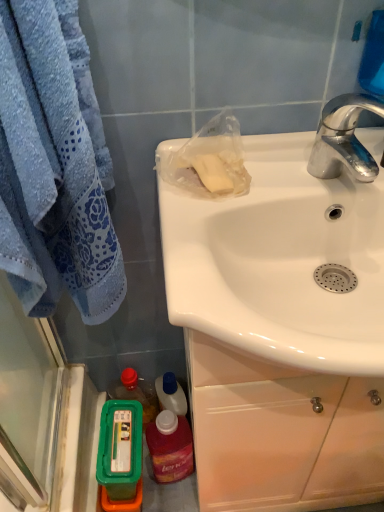
Identify the location of free spot to the left of chrome metallic faucet at upper right. (245, 219).